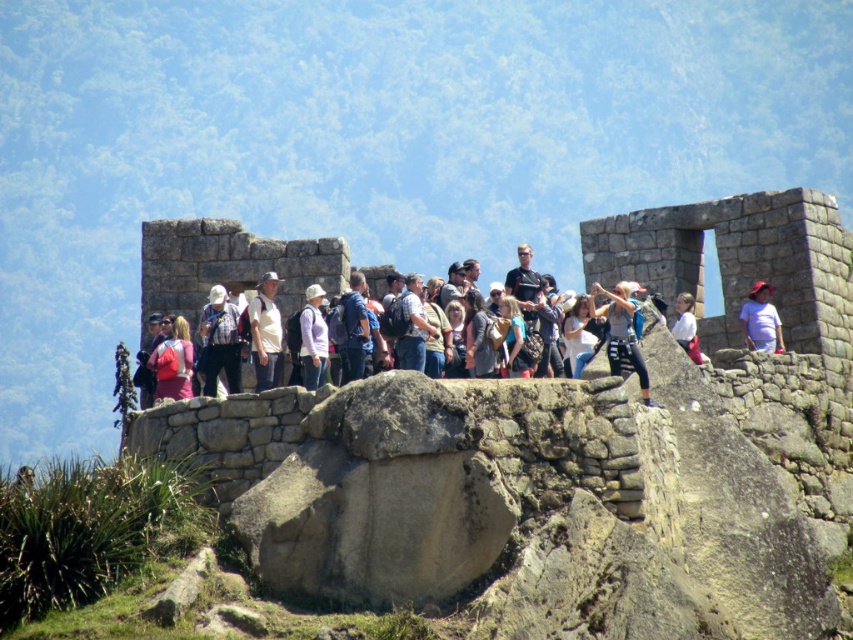
Question: Considering the real-world distances, which object is farthest from the white cotton shirt at upper right?

Choices:
 (A) matte red backpack at center
 (B) matte white shirt at center

Answer: (A)

Question: Does matte white shirt at center appear over white cotton shirt at upper right?

Choices:
 (A) yes
 (B) no

Answer: (B)

Question: Can you confirm if plaid shirt at center is smaller than denim jeans at center?

Choices:
 (A) yes
 (B) no

Answer: (A)

Question: Estimate the real-world distances between objects in this image. Which object is closer to the white cotton shirt at center?

Choices:
 (A) matte white shirt at center
 (B) white cotton shirt at upper right
 (C) matte red backpack at center
 (D) plaid shirt at center

Answer: (B)

Question: Which point appears closest to the camera in this image?

Choices:
 (A) (770, 349)
 (B) (584, 323)
 (C) (305, 356)

Answer: (C)

Question: Can you confirm if white cotton shirt at upper right is positioned to the left of white cotton shirt at center?

Choices:
 (A) no
 (B) yes

Answer: (A)